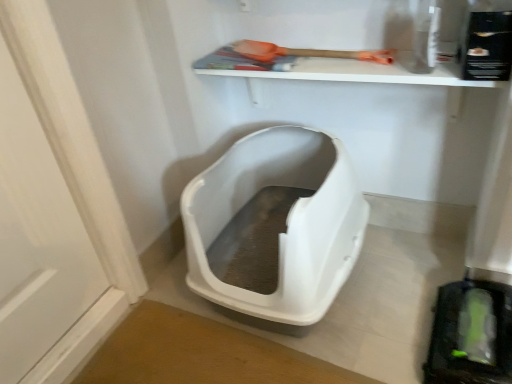
Find the location of a particular element. vacant area situated below orange plastic shovel at upper center (from a real-world perspective) is located at coordinates (333, 52).